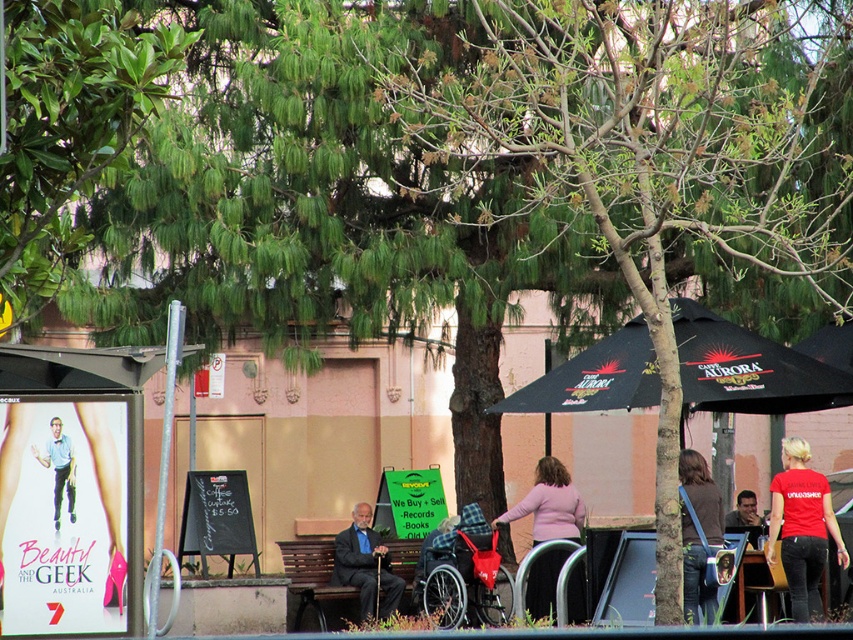
Which is in front, point (685, 538) or point (305, 545)?

Point (685, 538)

At what (x,y) coordinates should I click in order to perform the action: click on denim jacket at lower right. Please return your answer as a coordinate pair (x, y). The height and width of the screenshot is (640, 853). Looking at the image, I should click on (701, 493).

Does dark brown leather jacket at center have a greater height compared to dark blue fabric wheelchair at center?

Yes, dark brown leather jacket at center is taller than dark blue fabric wheelchair at center.

Does dark brown leather jacket at center have a greater width compared to dark blue fabric wheelchair at center?

Yes, dark brown leather jacket at center is wider than dark blue fabric wheelchair at center.

Where is `dark brown leather jacket at center`? The width and height of the screenshot is (853, 640). dark brown leather jacket at center is located at coordinates (364, 564).

Does red cotton shirt at lower right have a greater height compared to dark blue fabric wheelchair at center?

Correct, red cotton shirt at lower right is much taller as dark blue fabric wheelchair at center.

Is point (793, 486) farther from viewer compared to point (416, 580)?

No.

You are a GUI agent. You are given a task and a screenshot of the screen. Output one action in this format:
    pyautogui.click(x=<x>, y=<y>)
    Task: Click on the red cotton shirt at lower right
    The image size is (853, 640).
    Given the screenshot: What is the action you would take?
    pyautogui.click(x=801, y=528)